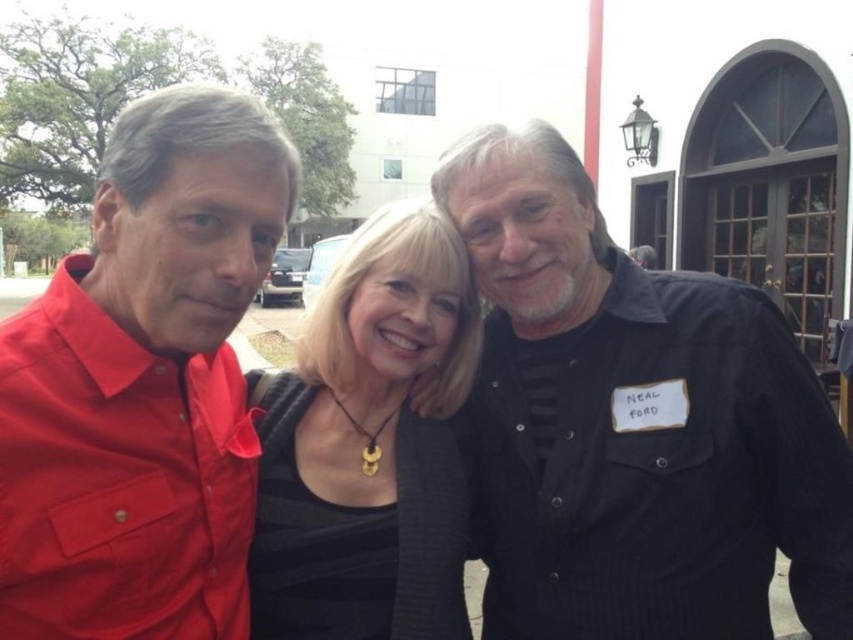
Question: Does black textured shirt at center appear over black matte dress at center?

Choices:
 (A) no
 (B) yes

Answer: (A)

Question: Estimate the real-world distances between objects in this image. Which object is closer to the black matte dress at center?

Choices:
 (A) matte red shirt at left
 (B) black textured shirt at center

Answer: (B)

Question: Among these objects, which one is nearest to the camera?

Choices:
 (A) black matte dress at center
 (B) matte red shirt at left

Answer: (B)

Question: Estimate the real-world distances between objects in this image. Which object is closer to the black matte dress at center?

Choices:
 (A) matte red shirt at left
 (B) black textured shirt at center

Answer: (B)

Question: From the image, what is the correct spatial relationship of black textured shirt at center in relation to matte red shirt at left?

Choices:
 (A) below
 (B) above

Answer: (A)

Question: Can you confirm if matte red shirt at left is bigger than black matte dress at center?

Choices:
 (A) yes
 (B) no

Answer: (B)